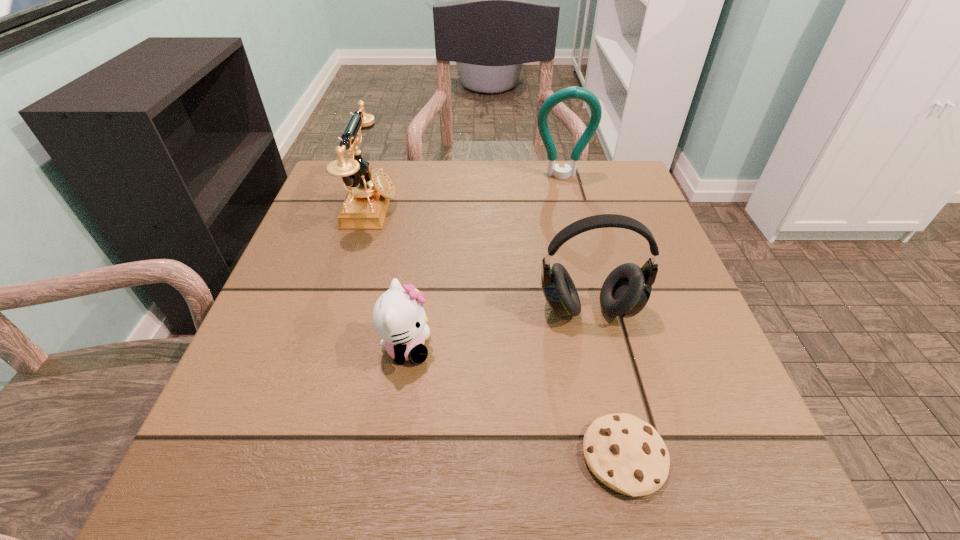
Where is `blank space located on the front-facing side of the kitten`? This screenshot has width=960, height=540. blank space located on the front-facing side of the kitten is located at coordinates (601, 348).

Find the location of a particular element. vacant space located on the left of the cookie is located at coordinates (296, 456).

At what (x,y) coordinates should I click in order to perform the action: click on bottle opener present at the far edge. Please return your answer as a coordinate pair (x, y). Looking at the image, I should click on (575, 92).

What are the coordinates of `telephone at the far edge` in the screenshot? It's located at (365, 206).

Find the location of a particular element. The image size is (960, 540). object that is at the near edge is located at coordinates (625, 453).

The width and height of the screenshot is (960, 540). I want to click on object that is at the left edge, so click(365, 206).

At what (x,y) coordinates should I click in order to perform the action: click on bottle opener at the right edge. Please return your answer as a coordinate pair (x, y). The width and height of the screenshot is (960, 540). Looking at the image, I should click on (575, 92).

At what (x,y) coordinates should I click in order to perform the action: click on headset that is at the right edge. Please return your answer as a coordinate pair (x, y). The image size is (960, 540). Looking at the image, I should click on (625, 292).

Where is `cookie that is at the right edge`? Image resolution: width=960 pixels, height=540 pixels. cookie that is at the right edge is located at coordinates (625, 453).

The image size is (960, 540). In order to click on object located at the far left corner in this screenshot , I will do `click(365, 206)`.